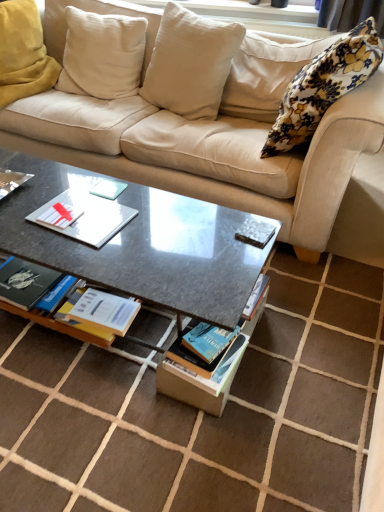
You are a GUI agent. You are given a task and a screenshot of the screen. Output one action in this format:
    pyautogui.click(x=<x>, y=<y>)
    Task: Click on the vacant area that lies between metallic silver book at left, which is the second book in right-to-left order, and white matte paper at center
    The image size is (384, 512).
    Given the screenshot: What is the action you would take?
    pyautogui.click(x=31, y=209)